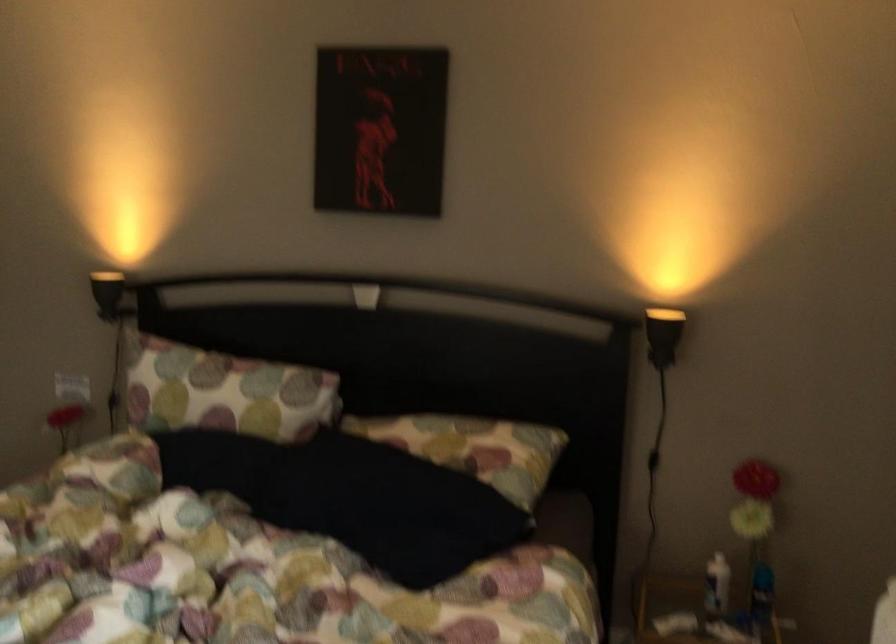
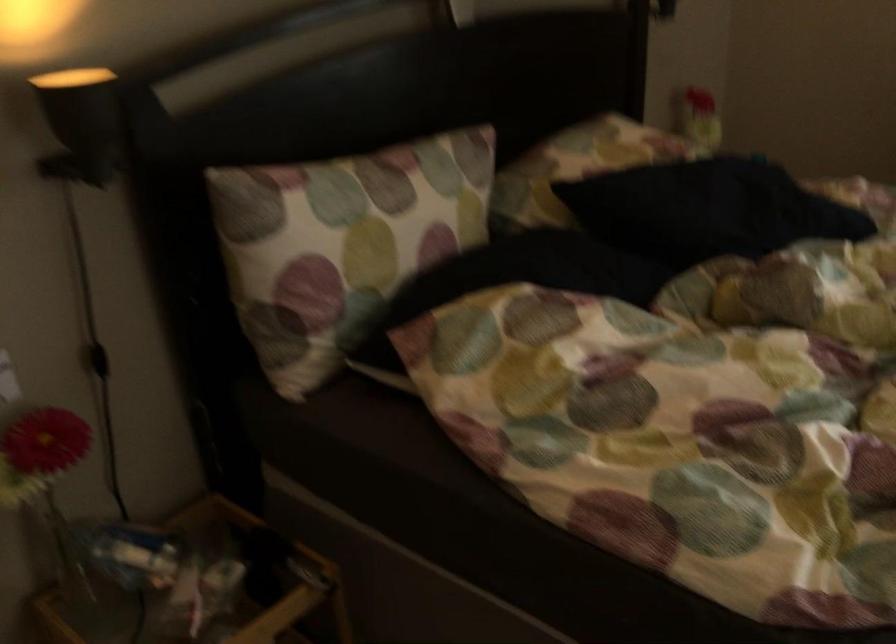
Find the pixel in the second image that matches [115,395] in the first image.

(98, 360)